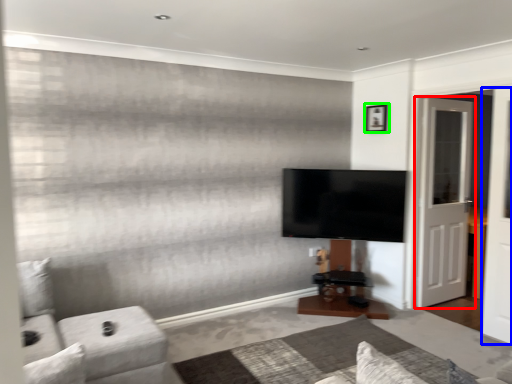
Question: Which object is positioned closest to door (highlighted by a red box)? Select from screen door (highlighted by a blue box) and picture frame (highlighted by a green box).

Choices:
 (A) screen door
 (B) picture frame

Answer: (A)